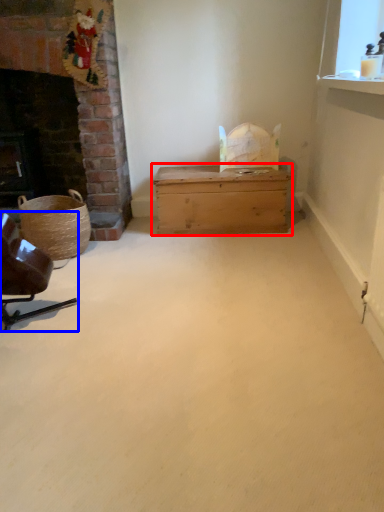
Question: Which object appears farthest to the camera in this image, table (highlighted by a red box) or chair (highlighted by a blue box)?

Choices:
 (A) table
 (B) chair

Answer: (A)